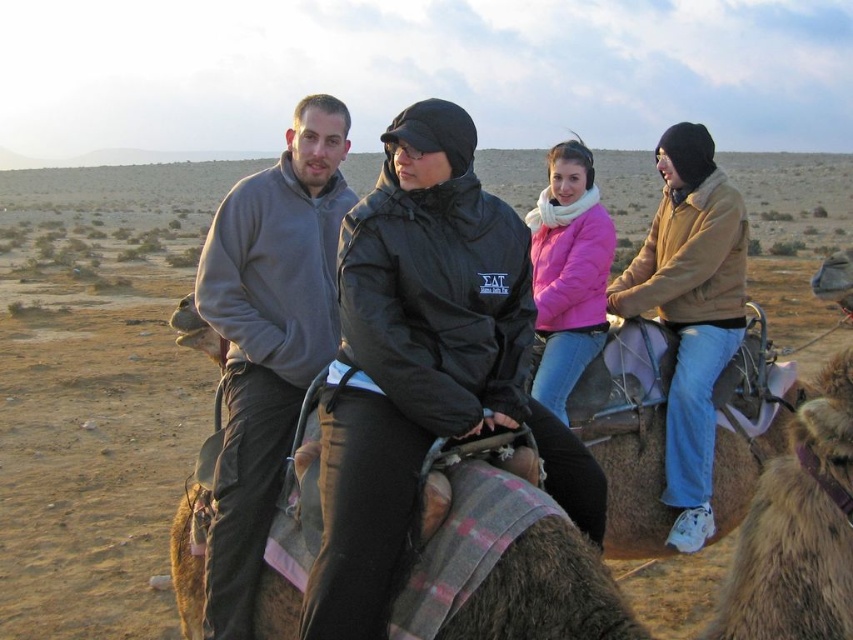
Does gray fleece jacket at center appear under pink matte jacket at center?

Yes.

Based on the photo, is gray fleece jacket at center shorter than pink matte jacket at center?

Incorrect, gray fleece jacket at center's height does not fall short of pink matte jacket at center's.

Which is behind, point (247, 429) or point (547, 257)?

The point (547, 257) is more distant.

I want to click on gray fleece jacket at center, so click(x=268, y=337).

Describe the element at coordinates (424, 362) in the screenshot. The image size is (853, 640). I see `black matte jacket at center` at that location.

Who is more forward, (331, 602) or (288, 429)?

Point (331, 602) is in front.

Where is `black matte jacket at center`? The width and height of the screenshot is (853, 640). black matte jacket at center is located at coordinates (424, 362).

Does black matte jacket at center have a lesser height compared to pink matte jacket at center?

Incorrect, black matte jacket at center's height does not fall short of pink matte jacket at center's.

Is black matte jacket at center above pink matte jacket at center?

Actually, black matte jacket at center is below pink matte jacket at center.

You are a GUI agent. You are given a task and a screenshot of the screen. Output one action in this format:
    pyautogui.click(x=<x>, y=<y>)
    Task: Click on the black matte jacket at center
    The height and width of the screenshot is (640, 853).
    Given the screenshot: What is the action you would take?
    pyautogui.click(x=424, y=362)

I want to click on black matte jacket at center, so click(424, 362).